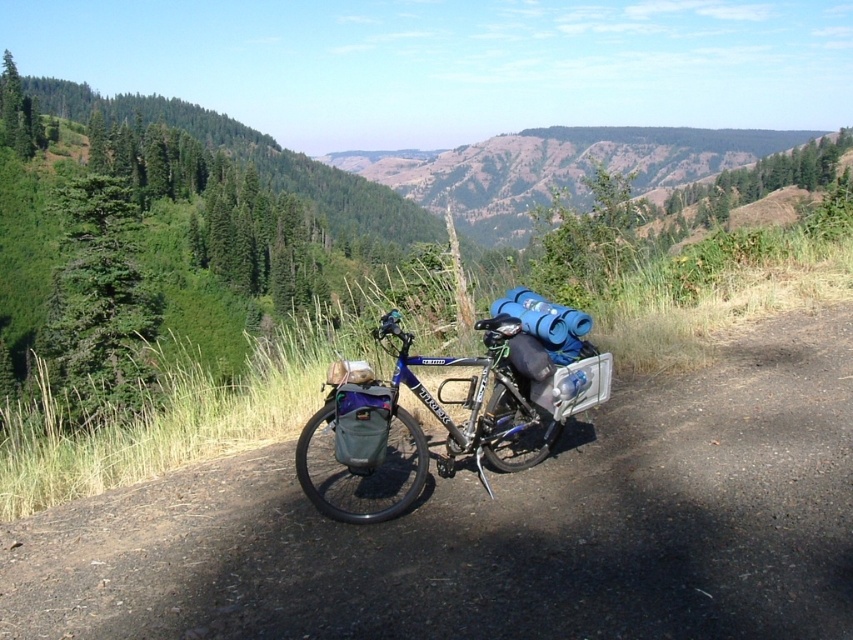
You are standing at the point marked by point (498, 529) on the dirt track at center. Looking towards the direction of the rolling hills and valleys in the background, which direction should you walk to stay on the dirt path?

The dirt track at center is marked by point (498, 529), so to stay on the dirt path, you should walk in the direction the path curves. Since the path curves gently through the landscape, follow its natural bend towards the rolling hills and valleys in the background.

You are planning to ride the blue metallic bicycle at center along the dirt track at center. Based on the size of the dirt track and the bicycle, will the bicycle fit comfortably on the track without needing to ride off the sides?

The dirt track at center has a smaller size compared to blue metallic bicycle at center, so the bicycle may not fit comfortably on the track without needing to ride off the sides.

You are planning to ride the blue metallic bicycle at center along the dirt track at center. Can the bicycle fit on the track? Explain your reasoning based on their sizes.

The dirt track at center is thinner than blue metallic bicycle at center, so the bicycle will not fit on the track because the track is narrower than the bicycle.